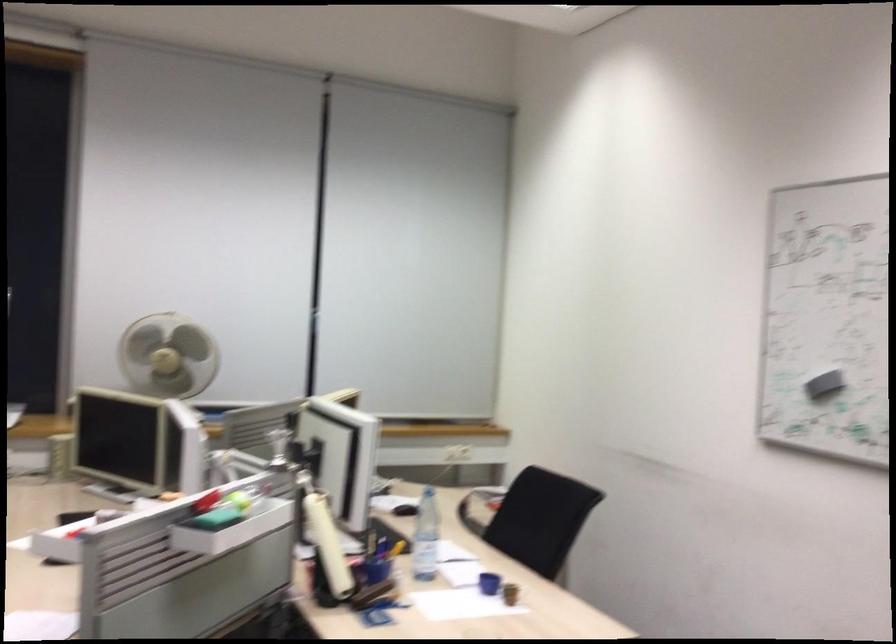
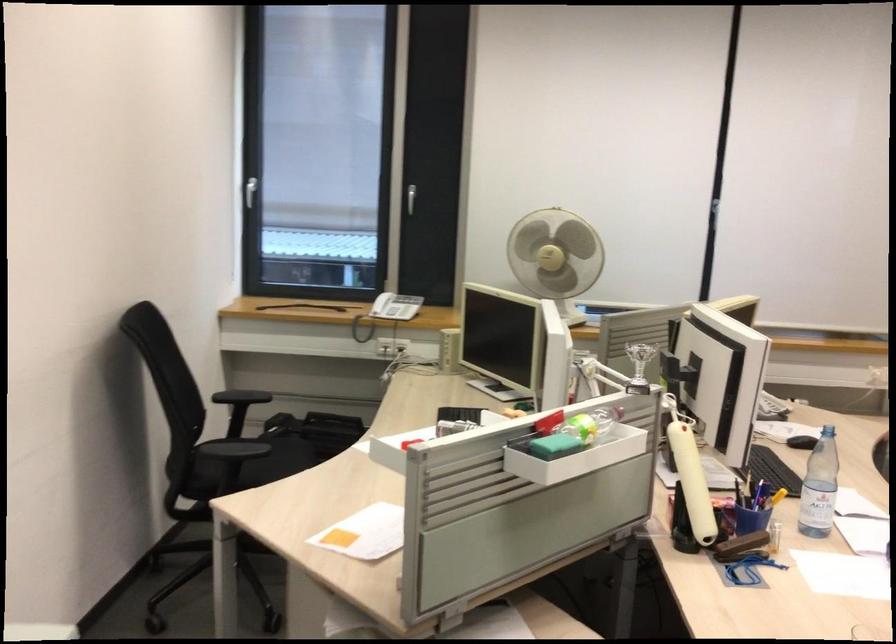
The point at [166,373] is marked in the first image. Where is the corresponding point in the second image?

(556, 257)